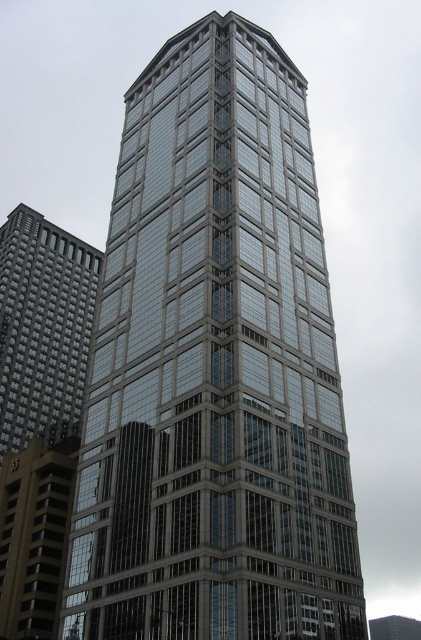
Does glassy steel tower at center have a greater width compared to matte gray building at left?

Correct, the width of glassy steel tower at center exceeds that of matte gray building at left.

In the scene shown: Is glassy steel tower at center to the left of matte gray building at left from the viewer's perspective?

In fact, glassy steel tower at center is to the right of matte gray building at left.

What do you see at coordinates (215, 369) in the screenshot? I see `glassy steel tower at center` at bounding box center [215, 369].

The height and width of the screenshot is (640, 421). I want to click on glassy steel tower at center, so click(215, 369).